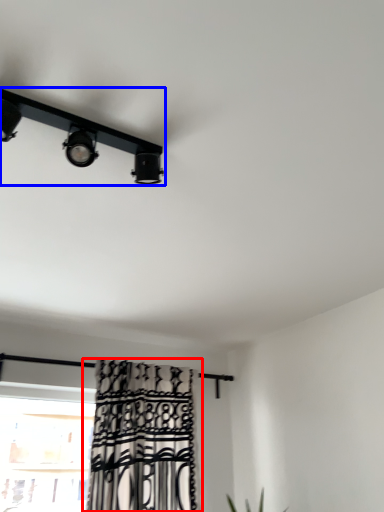
Question: Which object is closer to the camera taking this photo, curtain (highlighted by a red box) or lamp (highlighted by a blue box)?

Choices:
 (A) curtain
 (B) lamp

Answer: (B)